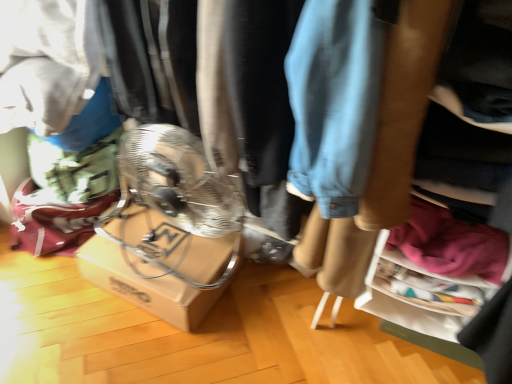
Question: Is pink fabric at lower right closer to camera compared to brown cardboard box at center?

Choices:
 (A) no
 (B) yes

Answer: (B)

Question: Is pink fabric at lower right outside of brown cardboard box at center?

Choices:
 (A) yes
 (B) no

Answer: (A)

Question: Is pink fabric at lower right wider than brown cardboard box at center?

Choices:
 (A) yes
 (B) no

Answer: (B)

Question: Is pink fabric at lower right placed right next to brown cardboard box at center?

Choices:
 (A) no
 (B) yes

Answer: (A)

Question: Can you confirm if pink fabric at lower right is thinner than brown cardboard box at center?

Choices:
 (A) yes
 (B) no

Answer: (A)

Question: From a real-world perspective, is pink fabric at lower right positioned under brown cardboard box at center based on gravity?

Choices:
 (A) yes
 (B) no

Answer: (B)

Question: Does brown cardboard box at center have a lesser height compared to pink fabric at lower right?

Choices:
 (A) no
 (B) yes

Answer: (B)

Question: Is brown cardboard box at center next to pink fabric at lower right and touching it?

Choices:
 (A) no
 (B) yes

Answer: (A)

Question: Can you confirm if brown cardboard box at center is smaller than pink fabric at lower right?

Choices:
 (A) no
 (B) yes

Answer: (A)

Question: Is brown cardboard box at center aimed at pink fabric at lower right?

Choices:
 (A) yes
 (B) no

Answer: (B)

Question: From a real-world perspective, is brown cardboard box at center located higher than pink fabric at lower right?

Choices:
 (A) no
 (B) yes

Answer: (A)

Question: From a real-world perspective, is brown cardboard box at center positioned under pink fabric at lower right based on gravity?

Choices:
 (A) no
 (B) yes

Answer: (B)

Question: Considering the positions of pink fabric at lower right and brown cardboard box at center in the image, is pink fabric at lower right taller or shorter than brown cardboard box at center?

Choices:
 (A) short
 (B) tall

Answer: (B)